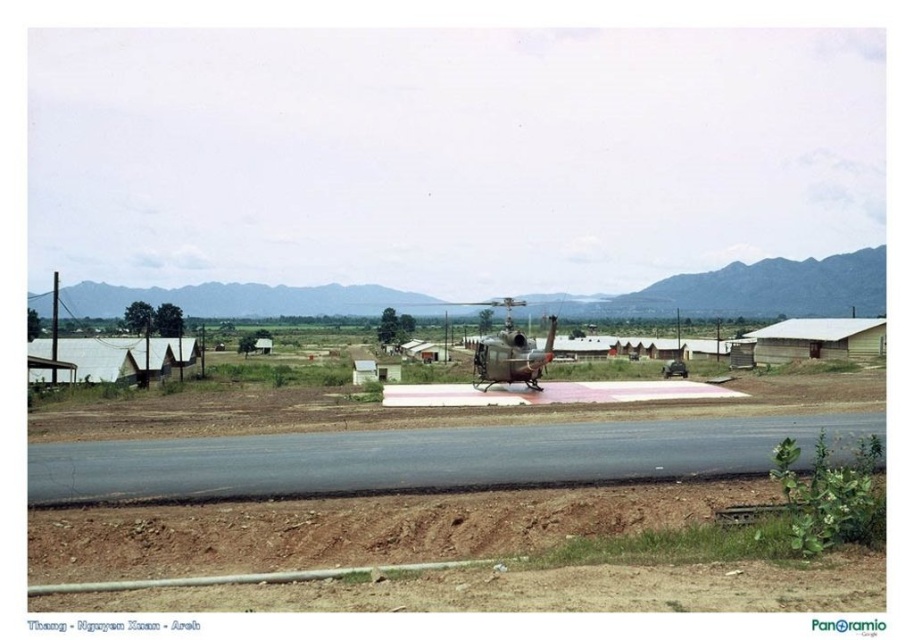
Is point (167, 477) farther from camera compared to point (533, 388)?

No, (167, 477) is in front of (533, 388).

What do you see at coordinates (428, 458) in the screenshot? I see `black asphalt runway at center` at bounding box center [428, 458].

At what (x,y) coordinates should I click in order to perform the action: click on black asphalt runway at center. Please return your answer as a coordinate pair (x, y). The image size is (914, 640). Looking at the image, I should click on (428, 458).